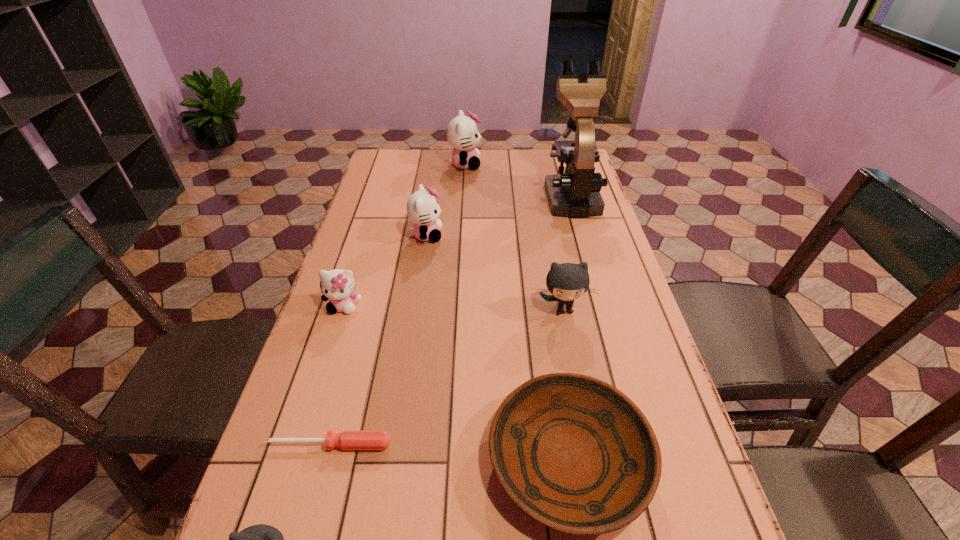
At what (x,y) coordinates should I click in order to perform the action: click on white kitten that stands as the second closest to the tallest kitten. Please return your answer as a coordinate pair (x, y). This screenshot has height=540, width=960. Looking at the image, I should click on (337, 285).

Select which white kitten appears as the second closest to the right gray kitten. Please provide its 2D coordinates. Your answer should be formatted as a tuple, i.e. [(x, y)], where the tuple contains the x and y coordinates of a point satisfying the conditions above.

[(337, 285)]

Locate an element on the screen. The height and width of the screenshot is (540, 960). vacant point that satisfies the following two spatial constraints: 1. on the front-facing side of the farthest white kitten; 2. on the front-facing side of the nearest white kitten is located at coordinates (458, 306).

In order to click on vacant area that satisfies the following two spatial constraints: 1. on the front-facing side of the second biggest white kitten; 2. on the front-facing side of the smallest white kitten in this screenshot , I will do `click(417, 306)`.

At what (x,y) coordinates should I click in order to perform the action: click on free space that satisfies the following two spatial constraints: 1. on the front-facing side of the second farthest kitten; 2. on the front-facing side of the leftmost white kitten. Please return your answer as a coordinate pair (x, y). This screenshot has width=960, height=540. Looking at the image, I should click on (417, 306).